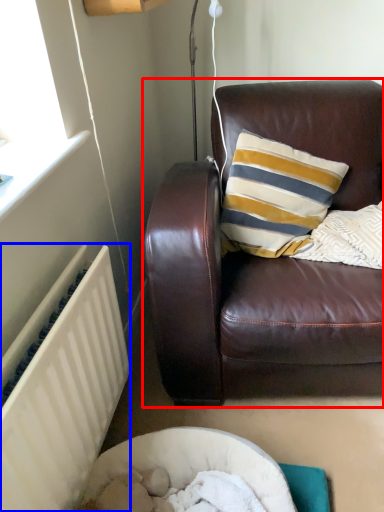
Question: Among these objects, which one is nearest to the camera, studio couch (highlighted by a red box) or radiator (highlighted by a blue box)?

Choices:
 (A) studio couch
 (B) radiator

Answer: (B)